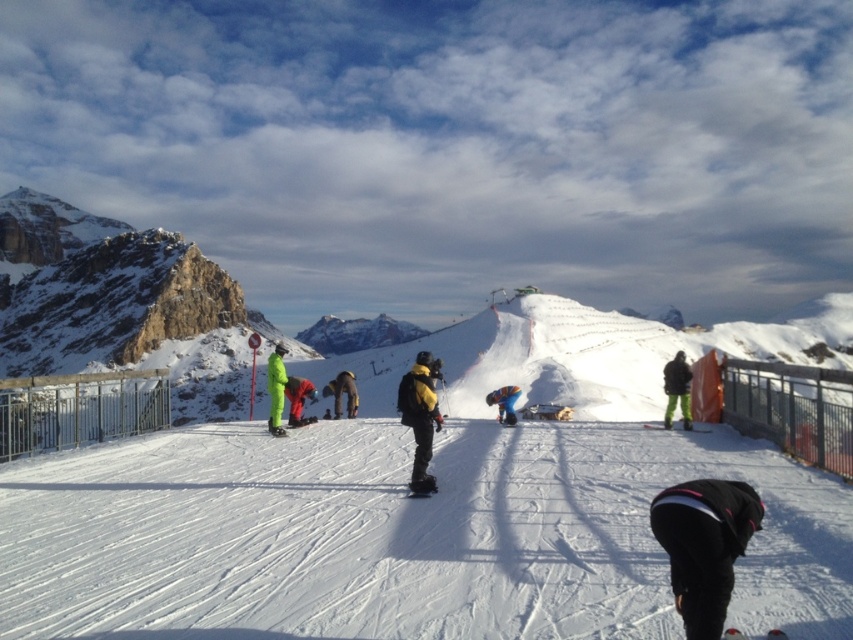
Based on the photo, you are a photographer positioned at the edge of the snow area. You want to capture a photo that includes both the yellow matte snowboard at center and the blue fabric jacket at center. Which object should you pan your camera to the right to include first?

You should pan your camera to the right to include the blue fabric jacket at center first because the yellow matte snowboard at center is to the left of the blue fabric jacket at center.

You are a photographer standing at the edge of the groomed snow area. You want to take a photo that includes both the yellow matte snowboard at center and the blue fabric jacket at center. The camera you are using has a maximum focus range of 15 meters. Will both subjects be in focus?

The yellow matte snowboard at center and blue fabric jacket at center are 15.22 meters apart. Since the maximum focus range is 15 meters, the distance between them exceeds the camera capability, so both subjects cannot be in focus simultaneously.